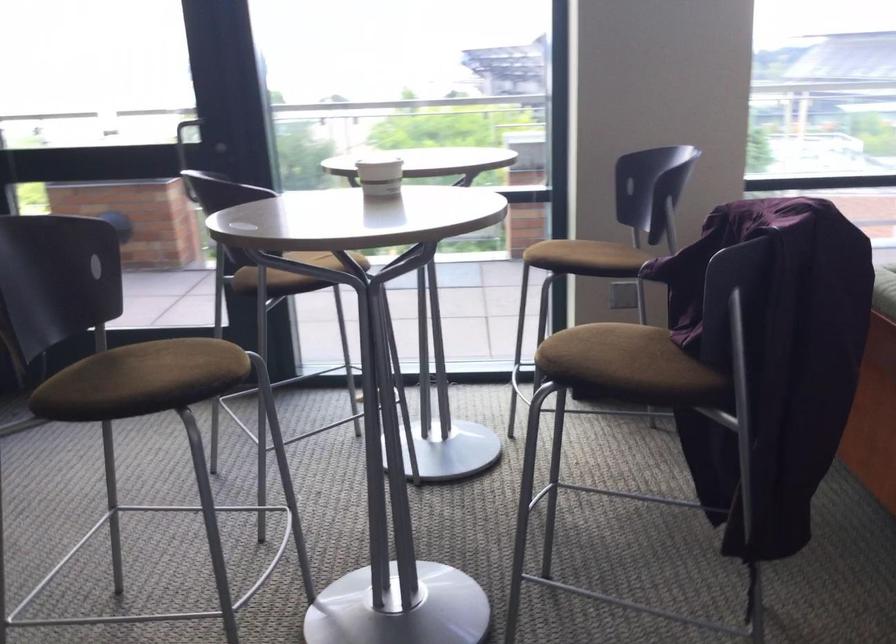
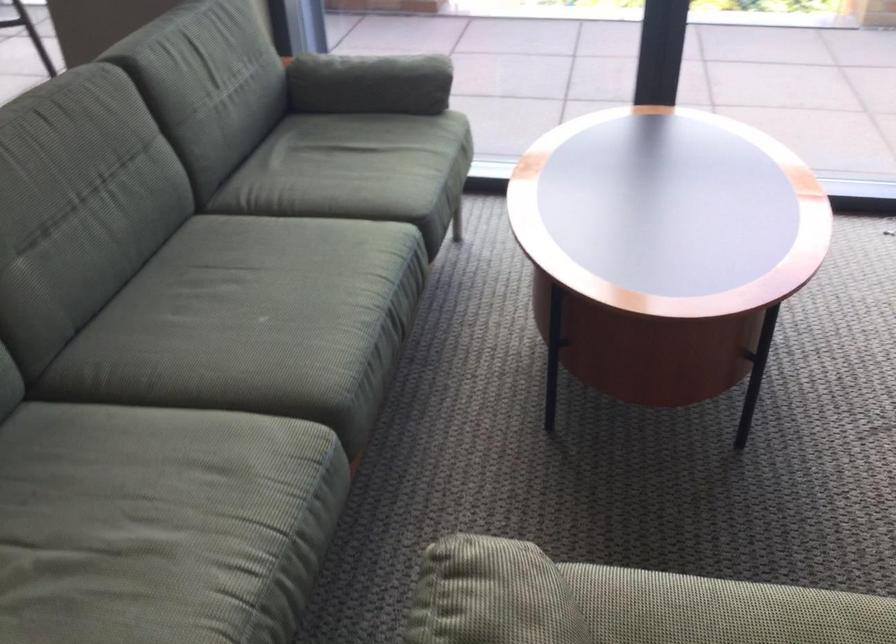
Question: What movement of the cameraman would produce the second image?

Choices:
 (A) Left
 (B) Right
 (C) Forward
 (D) Backward

Answer: (B)